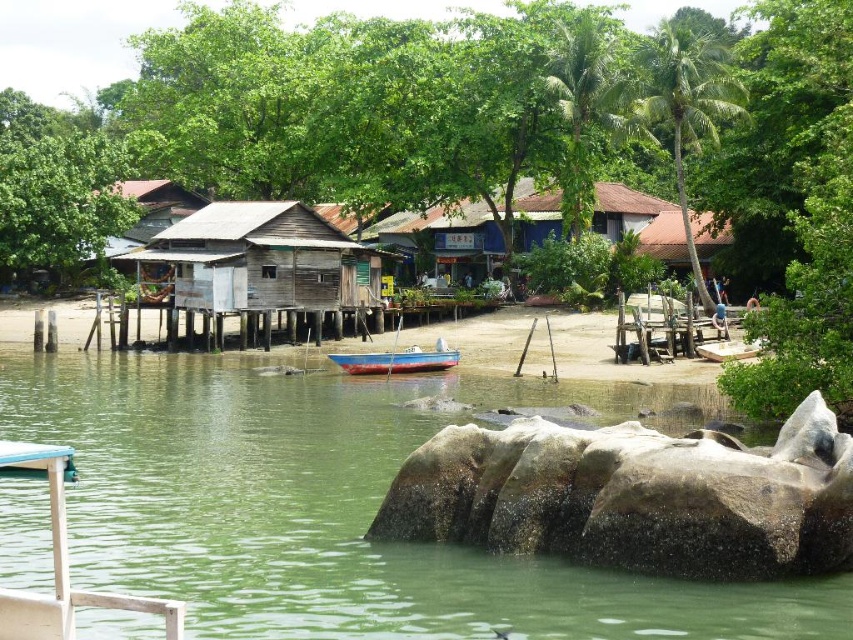
Question: Which of these objects is positioned closest to the weathered wood hut at center?

Choices:
 (A) brown wooden hut at upper left
 (B) gray rough rock at lower center
 (C) green leafy palm tree at upper right

Answer: (A)

Question: Which object appears closest to the camera in this image?

Choices:
 (A) weathered wood hut at center
 (B) green leafy tree at center
 (C) brown tile hut at center
 (D) green smooth water at center

Answer: (D)

Question: Is green leafy palm tree at upper right in front of brown tile hut at center?

Choices:
 (A) no
 (B) yes

Answer: (B)

Question: Does green smooth water at center have a lesser width compared to weathered wood hut at center?

Choices:
 (A) no
 (B) yes

Answer: (A)

Question: Does weathered wood hut at center have a smaller size compared to blue painted wood boat at center?

Choices:
 (A) yes
 (B) no

Answer: (B)

Question: Which object appears farthest from the camera in this image?

Choices:
 (A) green smooth water at center
 (B) gray rough rock at lower center

Answer: (B)